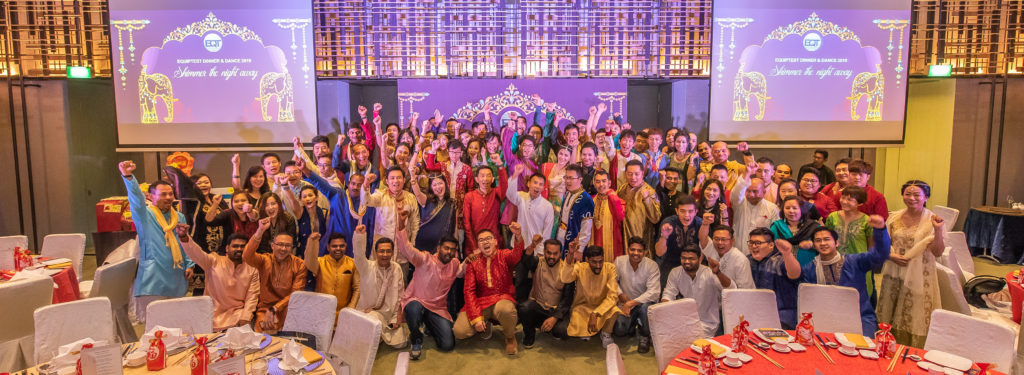
You are a GUI agent. You are given a task and a screenshot of the screen. Output one action in this format:
    pyautogui.click(x=<x>, y=<y>)
    Task: Click on the tables
    
    Given the screenshot: What is the action you would take?
    pyautogui.click(x=764, y=358), pyautogui.click(x=237, y=351), pyautogui.click(x=32, y=273)